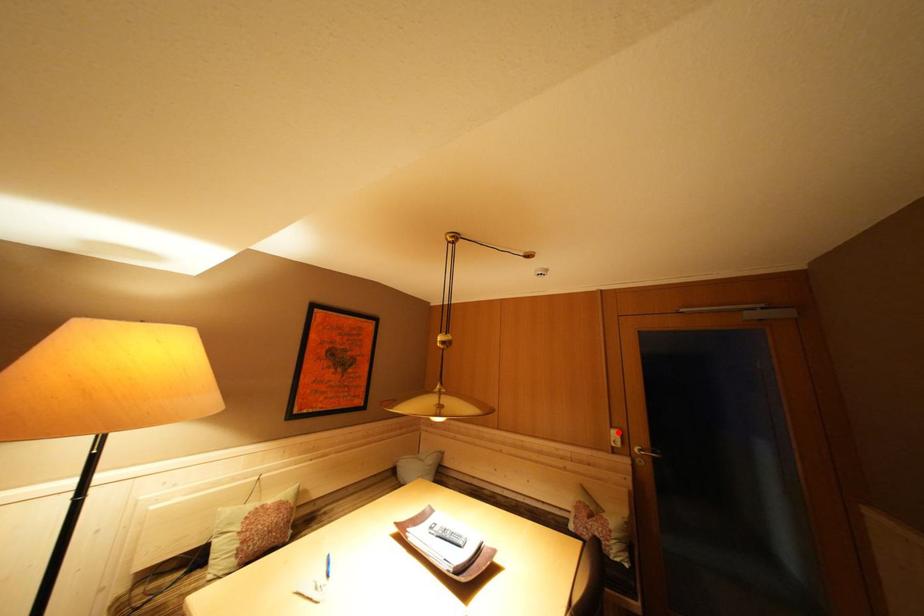
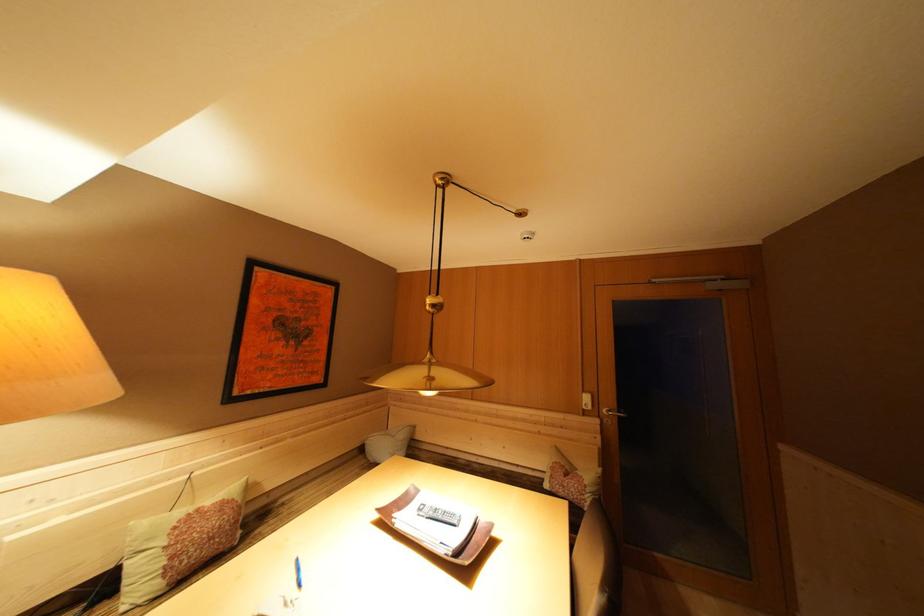
The point at the highlighted location is marked in the first image. Where is the corresponding point in the second image?

(590, 397)